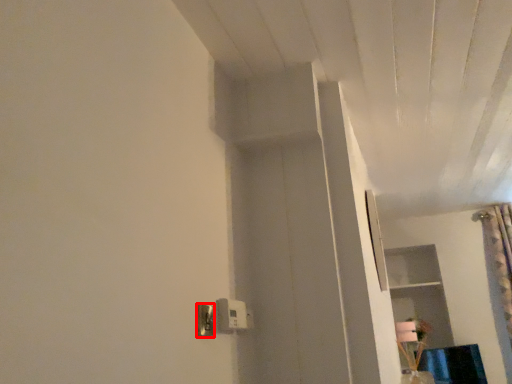
Question: Where is light switch (annotated by the red box) located in relation to light switch in the image?

Choices:
 (A) right
 (B) left

Answer: (B)